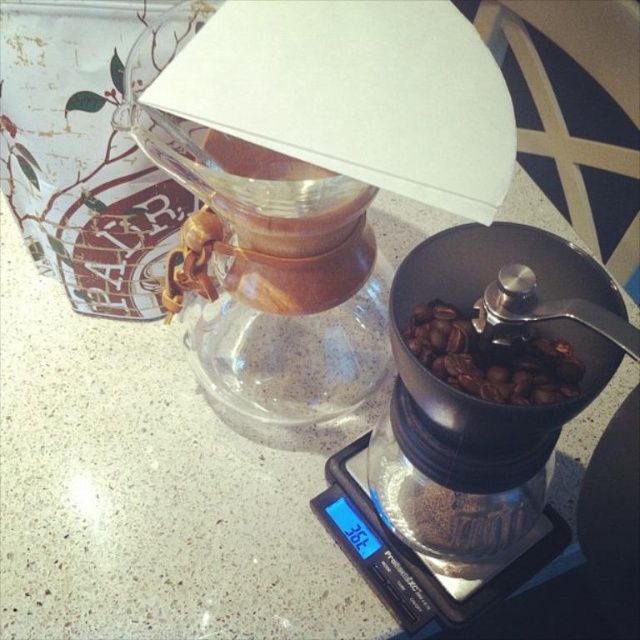
Question: Can you confirm if transparent glass carafe at upper center is positioned to the right of black matte coffee grinder at center?

Choices:
 (A) yes
 (B) no

Answer: (B)

Question: From the image, what is the correct spatial relationship of transparent glass carafe at upper center in relation to black matte coffee grinder at center?

Choices:
 (A) right
 (B) left

Answer: (B)

Question: Among these points, which one is nearest to the camera?

Choices:
 (A) (372, 186)
 (B) (525, 515)

Answer: (A)

Question: Considering the relative positions of transparent glass carafe at upper center and black matte coffee grinder at center in the image provided, where is transparent glass carafe at upper center located with respect to black matte coffee grinder at center?

Choices:
 (A) right
 (B) left

Answer: (B)